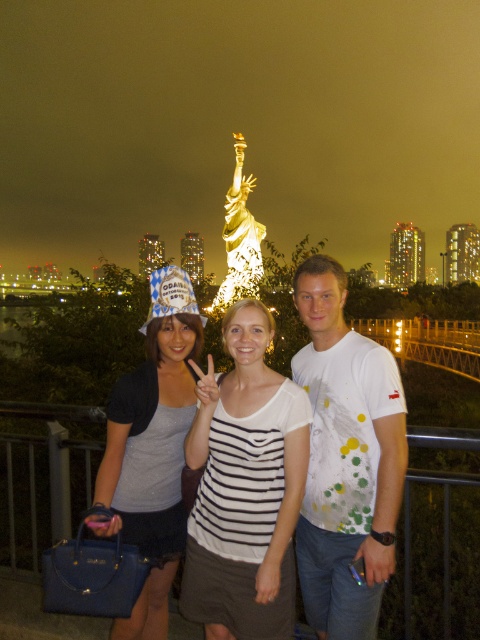
Question: Is white painted t-shirt at center closer to camera compared to matte gray tank top at center?

Choices:
 (A) yes
 (B) no

Answer: (B)

Question: Is white painted t-shirt at center wider than white striped shirt at center?

Choices:
 (A) yes
 (B) no

Answer: (B)

Question: In this image, where is white painted t-shirt at center located relative to white striped shirt at center?

Choices:
 (A) left
 (B) right

Answer: (B)

Question: Which point is closer to the camera?

Choices:
 (A) (332, 356)
 (B) (220, 512)
 (C) (142, 547)

Answer: (C)

Question: Which of the following is the farthest from the observer?

Choices:
 (A) (165, 589)
 (B) (204, 461)

Answer: (B)

Question: Which object is the closest to the white painted t-shirt at center?

Choices:
 (A) matte gray tank top at center
 (B) white striped shirt at center

Answer: (B)